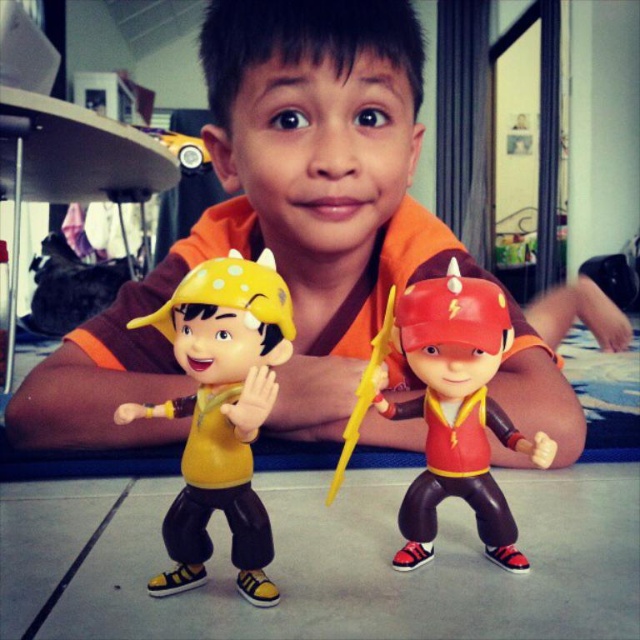
Where is `matte red plastic toy at center`? Image resolution: width=640 pixels, height=640 pixels. matte red plastic toy at center is located at coordinates (458, 412).

Who is taller, matte yellow plastic toy at lower left or yellow plastic sword at center?

matte yellow plastic toy at lower left

Locate an element on the screen. The height and width of the screenshot is (640, 640). matte yellow plastic toy at lower left is located at coordinates point(273,220).

Does point (253, 152) lie behind point (186, 460)?

Yes, point (253, 152) is behind point (186, 460).

Who is positioned more to the right, matte yellow plastic toy at lower left or yellow matte toy at center?

From the viewer's perspective, matte yellow plastic toy at lower left appears more on the right side.

At what (x,y) coordinates should I click in order to perform the action: click on matte yellow plastic toy at lower left. Please return your answer as a coordinate pair (x, y). The height and width of the screenshot is (640, 640). Looking at the image, I should click on click(x=273, y=220).